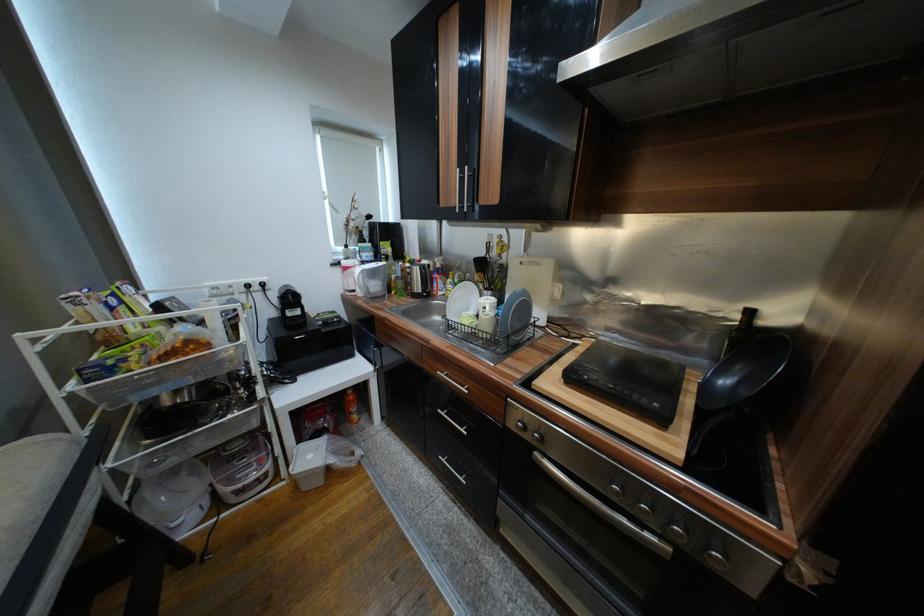
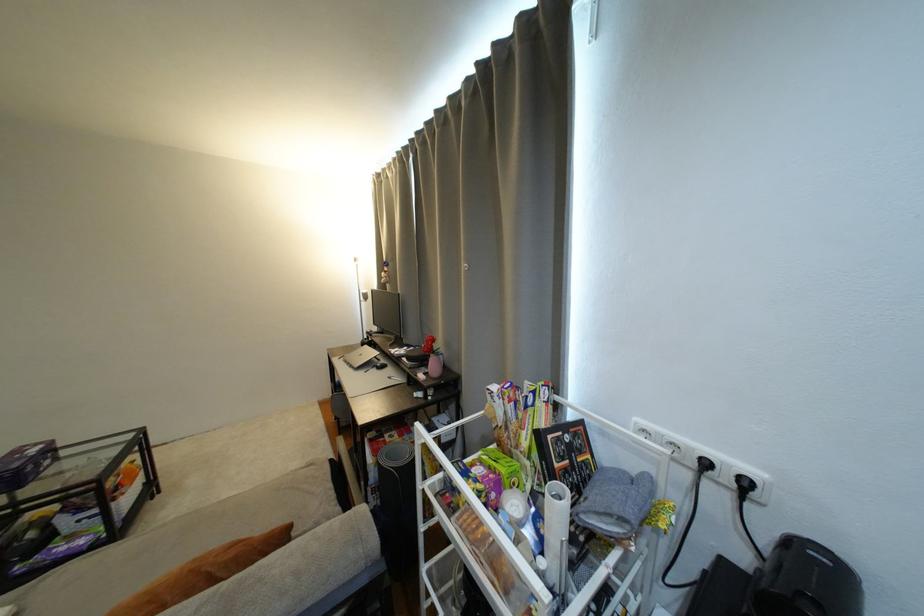
Find the pixel in the second image that matches (116,294) in the first image.

(541, 390)